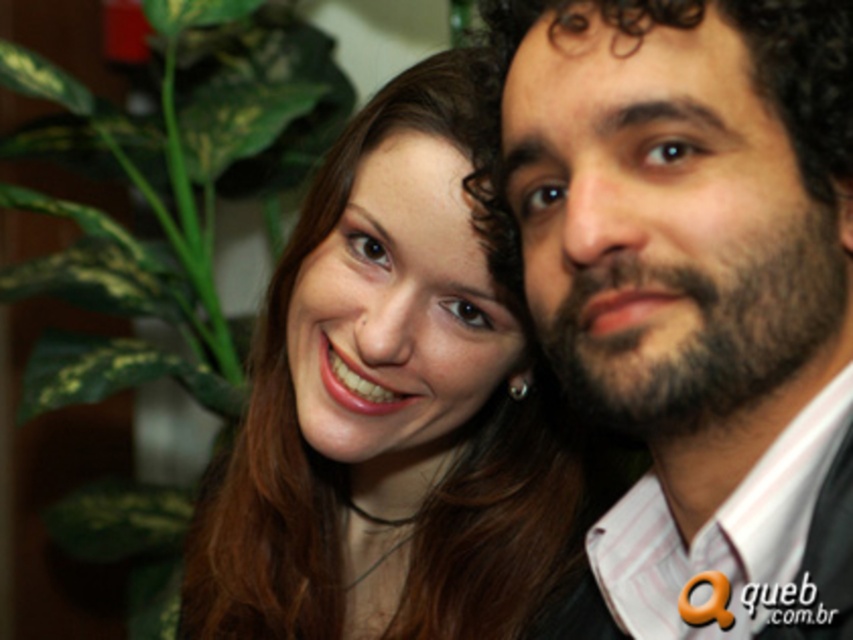
Between matte skin at center and green leafy plant at left, which one has more height?

Standing taller between the two is green leafy plant at left.

Is point (245, 612) closer to camera compared to point (83, 228)?

Yes, point (245, 612) is closer to viewer.

The width and height of the screenshot is (853, 640). I want to click on matte skin at center, so click(387, 410).

Is dark brown curly hair at right wider than green leafy plant at left?

No.

Between dark brown curly hair at right and green leafy plant at left, which one is positioned lower?

dark brown curly hair at right is lower down.

Locate an element on the screen. This screenshot has height=640, width=853. dark brown curly hair at right is located at coordinates (694, 296).

You are a GUI agent. You are given a task and a screenshot of the screen. Output one action in this format:
    pyautogui.click(x=<x>, y=<y>)
    Task: Click on the dark brown curly hair at right
    The width and height of the screenshot is (853, 640).
    Given the screenshot: What is the action you would take?
    pyautogui.click(x=694, y=296)

Who is taller, dark brown curly hair at right or matte skin at center?

With more height is matte skin at center.

Where is `dark brown curly hair at right`? The width and height of the screenshot is (853, 640). dark brown curly hair at right is located at coordinates (694, 296).

The height and width of the screenshot is (640, 853). What are the coordinates of `dark brown curly hair at right` in the screenshot? It's located at (694, 296).